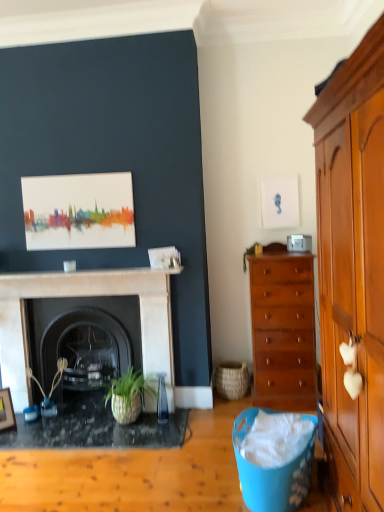
Question: Is the position of green leafy plant at center-right, the second plant viewed from the left, more distant than that of black marble fireplace at center, which is the 1th fireplace in front-to-back order?

Choices:
 (A) yes
 (B) no

Answer: (A)

Question: Is green leafy plant at center-right, the first plant positioned from the top, to the left of black marble fireplace at center, which is the 1th fireplace in front-to-back order, from the viewer's perspective?

Choices:
 (A) yes
 (B) no

Answer: (B)

Question: From the image's perspective, is green leafy plant at center-right, the 2th plant in the bottom-to-top sequence, below black marble fireplace at center, which is the 1th fireplace in front-to-back order?

Choices:
 (A) yes
 (B) no

Answer: (B)

Question: From the image's perspective, is green leafy plant at center-right, the first plant positioned from the top, on black marble fireplace at center, the second fireplace positioned from the back?

Choices:
 (A) yes
 (B) no

Answer: (A)

Question: Is green leafy plant at center-right, the first plant positioned from the top, taller than black marble fireplace at center, which is the 1th fireplace in front-to-back order?

Choices:
 (A) no
 (B) yes

Answer: (A)

Question: Considering the positions of black marble fireplace at center, which is the 1th fireplace in front-to-back order, and green woven plant at left, which is the 2th plant from right to left, in the image, is black marble fireplace at center, which is the 1th fireplace in front-to-back order, wider or thinner than green woven plant at left, which is the 2th plant from right to left,?

Choices:
 (A) wide
 (B) thin

Answer: (B)

Question: Is point (172, 380) closer or farther from the camera than point (56, 371)?

Choices:
 (A) closer
 (B) farther

Answer: (A)

Question: Considering their positions, is black marble fireplace at center, the second fireplace positioned from the back, located in front of or behind green woven plant at left, which is the 2th plant from right to left?

Choices:
 (A) behind
 (B) front

Answer: (B)

Question: From the image's perspective, relative to green woven plant at left, which is the 1th plant from bottom to top, is black marble fireplace at center, the second fireplace positioned from the back, above or below?

Choices:
 (A) above
 (B) below

Answer: (A)

Question: From their relative heights in the image, would you say green woven plant at left, positioned as the 1th plant in left-to-right order, is taller or shorter than wooden picture frame at lower left?

Choices:
 (A) tall
 (B) short

Answer: (A)

Question: In terms of width, does green woven plant at left, which is the 1th plant from bottom to top, look wider or thinner when compared to wooden picture frame at lower left?

Choices:
 (A) wide
 (B) thin

Answer: (A)

Question: Is point (29, 373) positioned closer to the camera than point (6, 395)?

Choices:
 (A) farther
 (B) closer

Answer: (A)

Question: In terms of size, does green woven plant at left, which appears as the 2th plant when viewed from the top, appear bigger or smaller than wooden picture frame at lower left?

Choices:
 (A) small
 (B) big

Answer: (B)

Question: Looking at the image, does granite black desk at center seem bigger or smaller compared to woven natural basket at lower center?

Choices:
 (A) big
 (B) small

Answer: (A)

Question: Considering the positions of point (x=72, y=423) and point (x=218, y=371), is point (x=72, y=423) closer or farther from the camera than point (x=218, y=371)?

Choices:
 (A) closer
 (B) farther

Answer: (A)